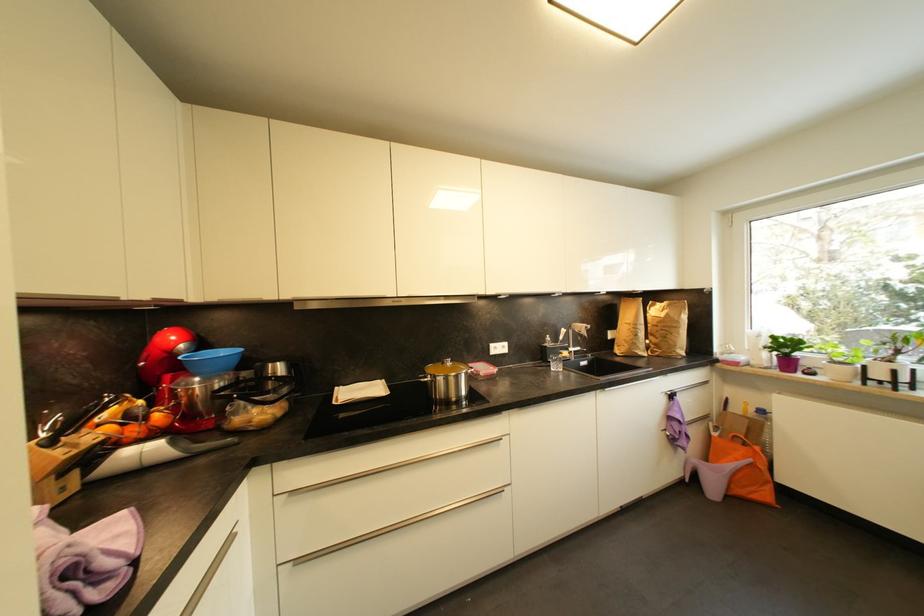
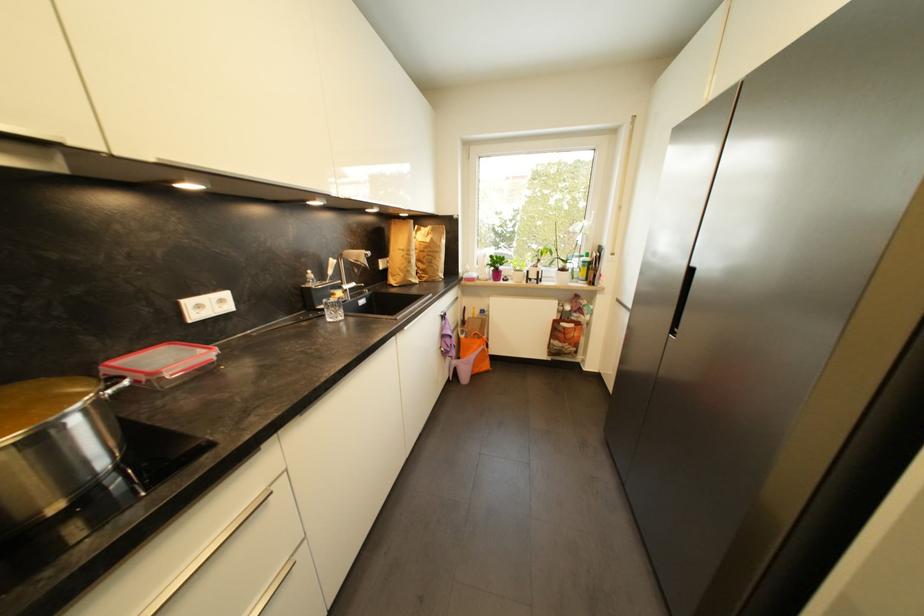
In the second image, find the point that corresponds to point 777,339 in the first image.

(495, 257)